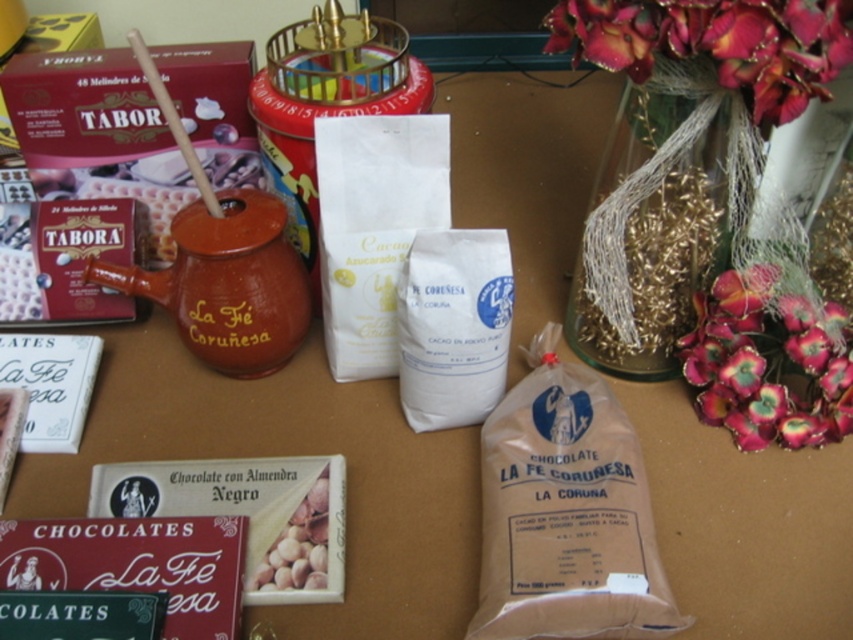
Does brown paper bag at center have a lesser width compared to brown matte chocolate bar at center?

No, brown paper bag at center is not thinner than brown matte chocolate bar at center.

Who is shorter, brown paper bag at center or brown matte chocolate bar at center?

With less height is brown matte chocolate bar at center.

Which is in front, point (608, 573) or point (270, 576)?

Point (608, 573)

I want to click on brown paper bag at center, so click(x=566, y=513).

Who is more forward, (x=305, y=298) or (x=285, y=554)?

Point (x=285, y=554) is in front.

Does point (91, 268) lie in front of point (258, 573)?

No, (91, 268) is further to viewer.

Find the location of `matte clay teapot at center-left`. matte clay teapot at center-left is located at coordinates (227, 284).

Looking at this image, is the position of brown paper bag at center more distant than that of matte clay teapot at center-left?

No, it is not.

Which of these two, brown paper bag at center or matte clay teapot at center-left, stands shorter?

Standing shorter between the two is matte clay teapot at center-left.

Is point (549, 621) positioned after point (300, 308)?

No, (549, 621) is in front of (300, 308).

This screenshot has width=853, height=640. In order to click on brown paper bag at center in this screenshot , I will do `click(566, 513)`.